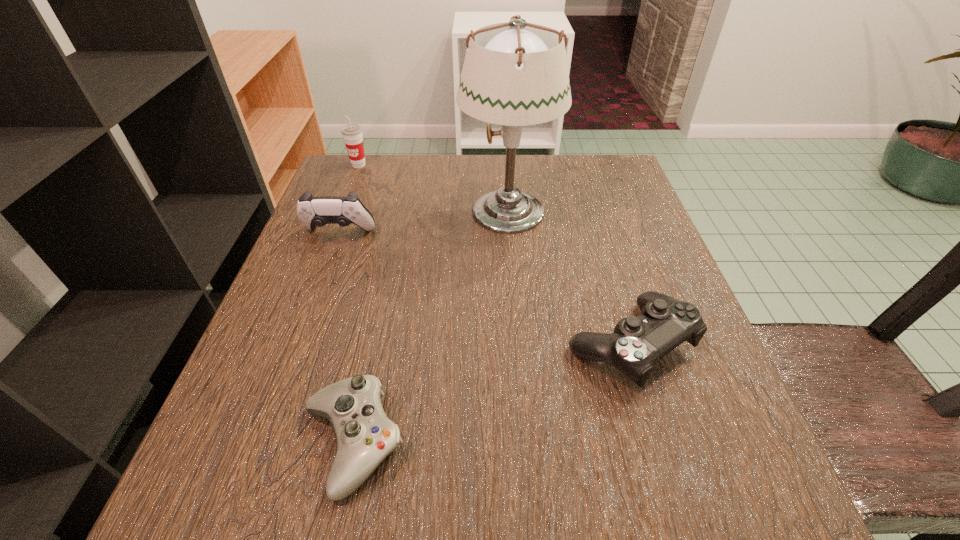
Locate an element on the screen. empty space that is in between the shortest control and the cup is located at coordinates (355, 304).

Where is `empty space that is in between the rightmost control and the tallest object`? empty space that is in between the rightmost control and the tallest object is located at coordinates (568, 278).

Locate an element on the screen. The height and width of the screenshot is (540, 960). free space between the cup and the shortest object is located at coordinates (355, 304).

What are the coordinates of `vacant space in between the farthest control and the shortest object` in the screenshot? It's located at (346, 338).

Where is `empty space that is in between the fourth shortest object and the shortest control`? This screenshot has height=540, width=960. empty space that is in between the fourth shortest object and the shortest control is located at coordinates (355, 304).

Find the location of a particular element. The image size is (960, 540). unoccupied area between the shortest object and the farthest control is located at coordinates (346, 338).

The height and width of the screenshot is (540, 960). I want to click on the closest object to the farthest object, so click(312, 211).

Point out which object is positioned as the fourth nearest to the rightmost control. Please provide its 2D coordinates. Your answer should be formatted as a tuple, i.e. [(x, y)], where the tuple contains the x and y coordinates of a point satisfying the conditions above.

[(352, 134)]

Find the location of a particular element. This screenshot has width=960, height=540. control that is the third nearest to the cup is located at coordinates (364, 435).

Choose which control is the second nearest neighbor to the lampshade. Please provide its 2D coordinates. Your answer should be formatted as a tuple, i.e. [(x, y)], where the tuple contains the x and y coordinates of a point satisfying the conditions above.

[(312, 211)]